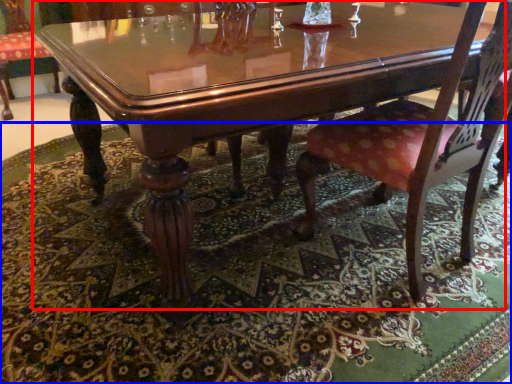
Question: Which of the following is the closest to the observer, coffee table (highlighted by a red box) or place mat (highlighted by a blue box)?

Choices:
 (A) coffee table
 (B) place mat

Answer: (B)